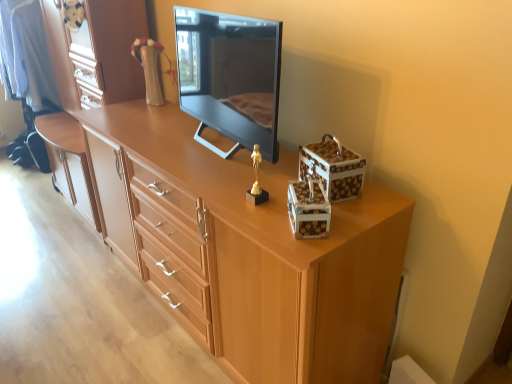
Find the location of a particular element. This screenshot has width=512, height=384. spots to the right of white glossy storage box at upper right, the 1th storage box when ordered from front to back is located at coordinates (358, 218).